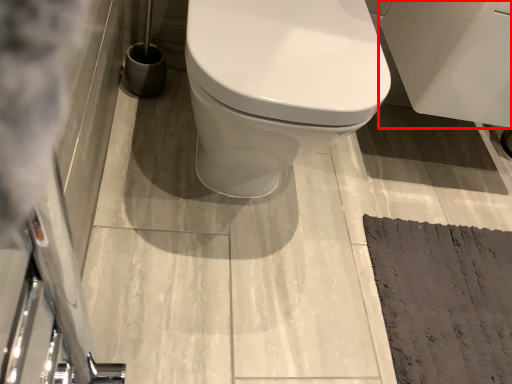
Question: From the image, what is the correct spatial relationship of porcelain (annotated by the red box) in relation to doormat?

Choices:
 (A) left
 (B) right

Answer: (B)